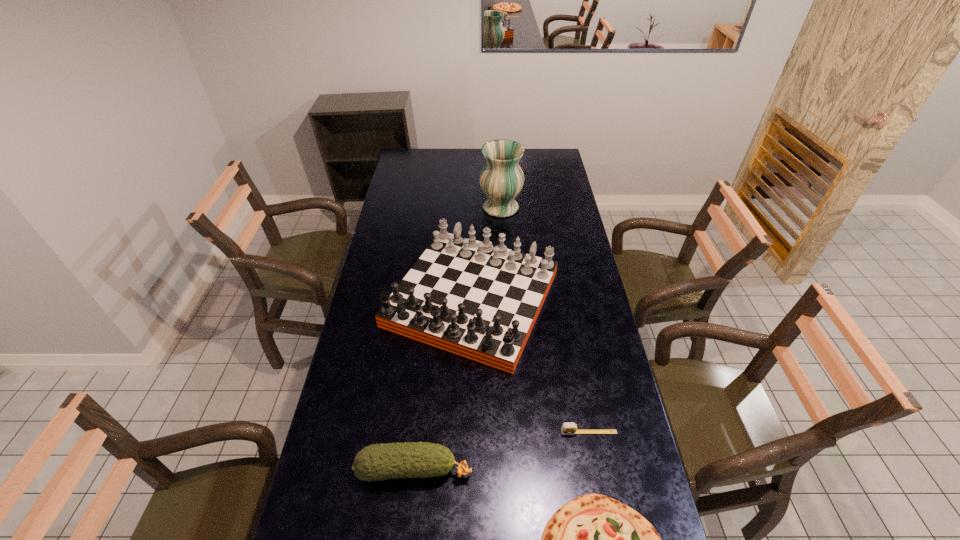
The height and width of the screenshot is (540, 960). Identify the location of the tallest object. pos(501,179).

You are a GUI agent. You are given a task and a screenshot of the screen. Output one action in this format:
    pyautogui.click(x=<x>, y=<y>)
    Task: Click on the vase
    
    Given the screenshot: What is the action you would take?
    pyautogui.click(x=501, y=179)

This screenshot has width=960, height=540. Find the location of `gameboard`. gameboard is located at coordinates (474, 299).

Where is `the second tallest object`? the second tallest object is located at coordinates (474, 299).

At what (x,y) coordinates should I click in order to perform the action: click on the second nearest object. Please return your answer as a coordinate pair (x, y). Looking at the image, I should click on (381, 461).

Where is `cucumber`? The height and width of the screenshot is (540, 960). cucumber is located at coordinates (381, 461).

Find the location of a particular element. the fourth tallest object is located at coordinates (570, 428).

Locate an element on the screen. The width and height of the screenshot is (960, 540). tape measure is located at coordinates (570, 428).

Find the location of a particular element. This screenshot has width=960, height=540. free spot located on the left of the farthest object is located at coordinates (398, 208).

You are a GUI agent. You are given a task and a screenshot of the screen. Output one action in this format:
    pyautogui.click(x=<x>, y=<y>)
    Task: Click on the free space located 0.180m on the back of the second tallest object
    The height and width of the screenshot is (540, 960).
    Given the screenshot: What is the action you would take?
    pyautogui.click(x=473, y=218)